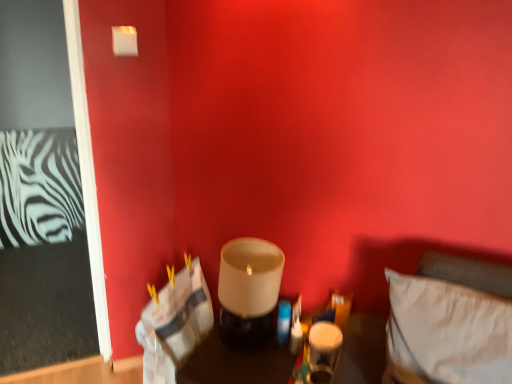
Where is `vacant area in front of matte white glass at center, placed as the first candle holder when sorted from left to right`? This screenshot has width=512, height=384. vacant area in front of matte white glass at center, placed as the first candle holder when sorted from left to right is located at coordinates (241, 370).